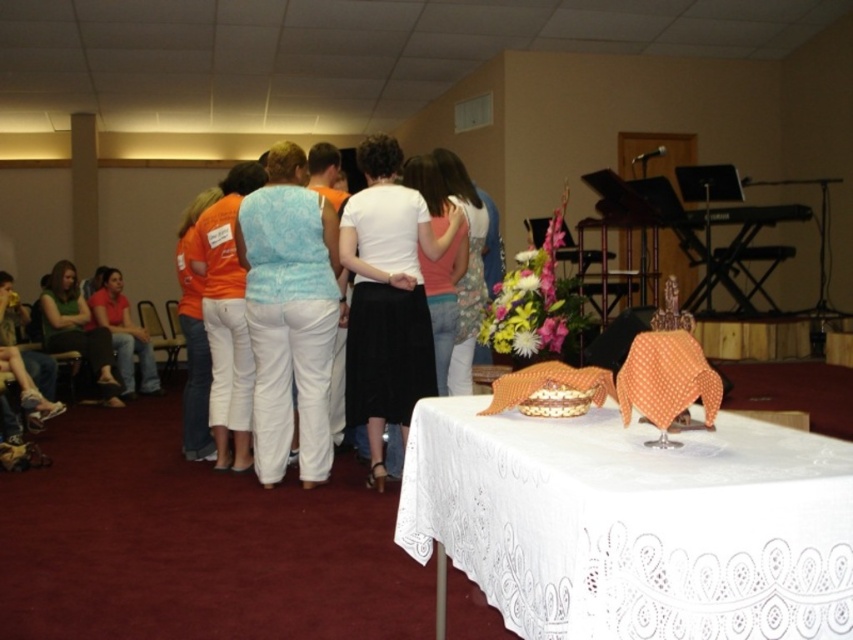
You are attending an event in this room and notice two clothing items on the table. The white matte skirt at center and the orange cotton shirt at center. Which one is located to the right of the other?

The white matte skirt at center is positioned on the right side of orange cotton shirt at center.

You are attending an event in this room and need to hand a document to both the person wearing the white matte skirt at center and the person wearing the green fabric shirt at lower left. Which person should you approach first to ensure you can reach them without moving past the other?

You should approach the white matte skirt at center first because it is closer to you than the green fabric shirt at lower left, so you can reach them without needing to move past the other person.